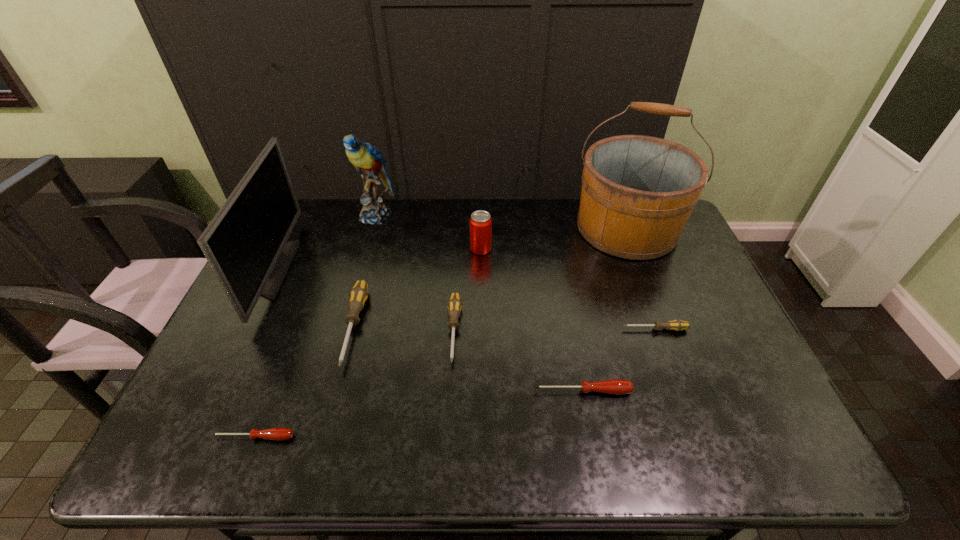
You are a GUI agent. You are given a task and a screenshot of the screen. Output one action in this format:
    pyautogui.click(x=<x>, y=<y>)
    Task: Click on the vacant space at the left edge of the desktop
    
    Given the screenshot: What is the action you would take?
    pyautogui.click(x=288, y=280)

The width and height of the screenshot is (960, 540). In the image, there is a desktop. Find the location of `free region at the right edge`. free region at the right edge is located at coordinates (696, 260).

Locate an element on the screen. vacant point located between the fifth object from left to right and the nearest object is located at coordinates (354, 384).

The width and height of the screenshot is (960, 540). I want to click on vacant area that lies between the nearest screwdriver and the fifth tallest object, so click(304, 382).

I want to click on empty space between the second smallest gray screwdriver and the tallest object, so click(x=540, y=280).

What are the coordinates of `free point between the fourth screwdriver from left to right and the leftmost object` in the screenshot? It's located at (427, 330).

Find the location of a particular element. The height and width of the screenshot is (540, 960). free area in between the eighth farthest object and the fourth tallest object is located at coordinates (531, 320).

Find the location of `vacant area between the fifth object from left to right and the rightmost screwdriver`. vacant area between the fifth object from left to right and the rightmost screwdriver is located at coordinates (555, 330).

Find the location of a particular element. vacant region between the second gray screwdriver from left to right and the leftmost screwdriver is located at coordinates (354, 384).

Find the location of a particular element. The image size is (960, 540). free space between the parrot and the bigger red screwdriver is located at coordinates coord(479,303).